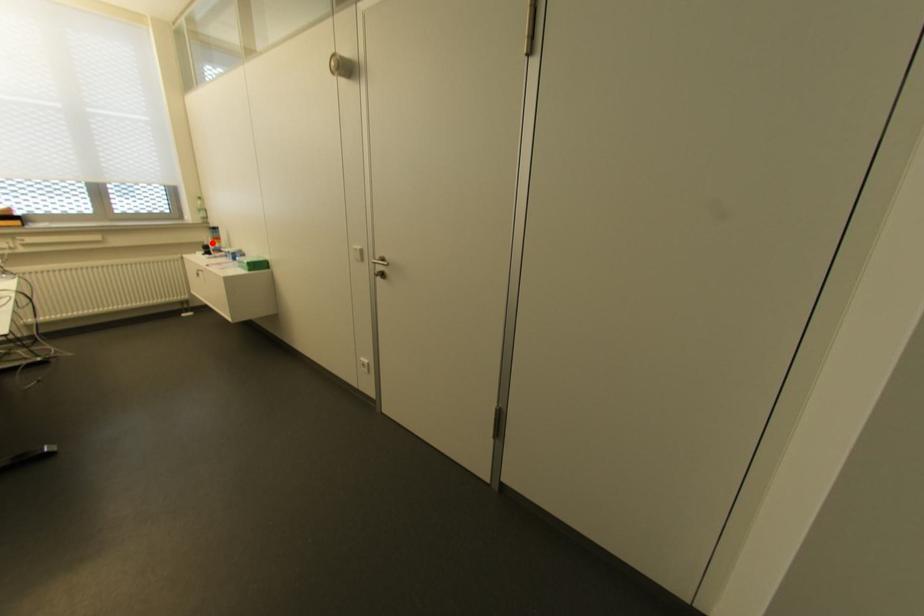
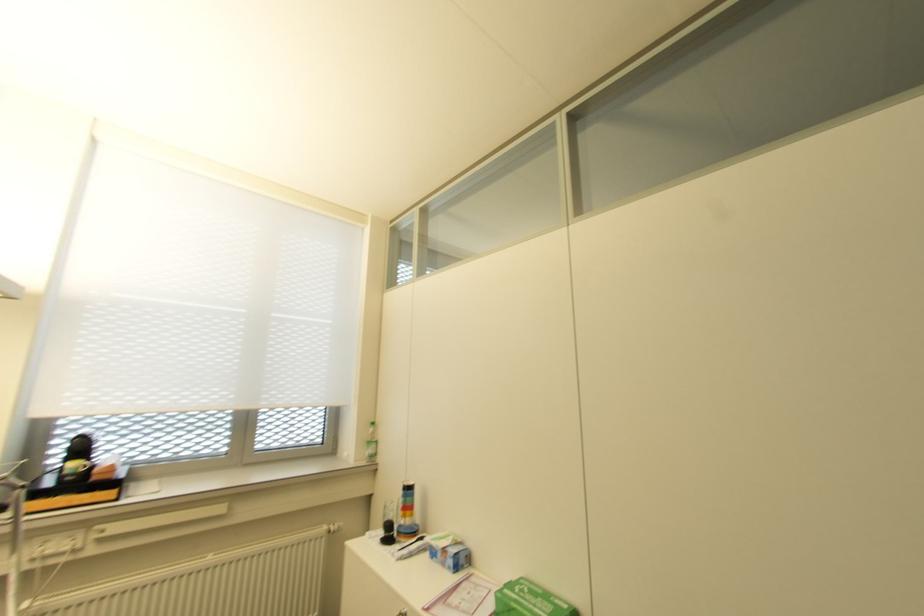
Locate, in the second image, the point that corresponds to the highlighted location in the first image.

(402, 517)